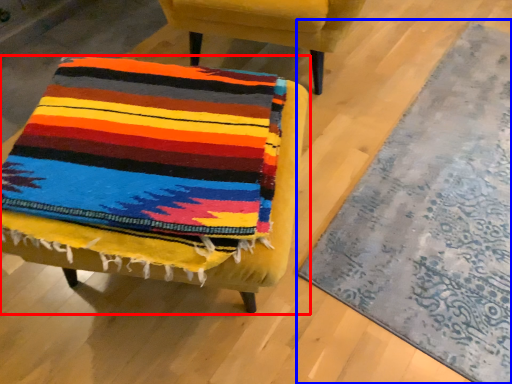
Question: Which of the following is the closest to the observer, chair (highlighted by a red box) or mat (highlighted by a blue box)?

Choices:
 (A) chair
 (B) mat

Answer: (A)